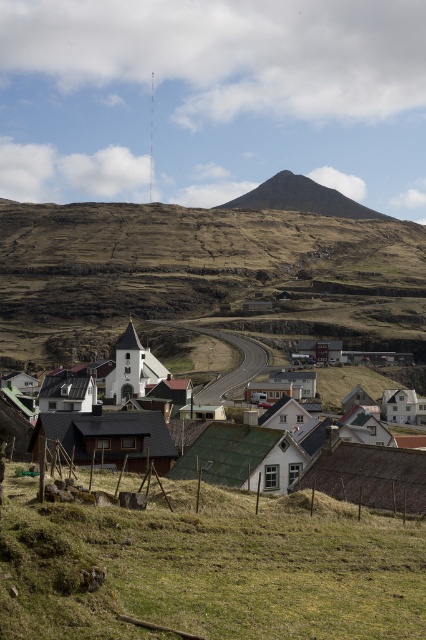
Who is more distant from viewer, (207, 561) or (120, 291)?

The point (120, 291) is behind.

Is green grassy hillside at lower center above brown grassy hillside at center?

Incorrect, green grassy hillside at lower center is not positioned above brown grassy hillside at center.

Is point (52, 621) in front of point (143, 296)?

Yes, it is in front of point (143, 296).

This screenshot has height=640, width=426. Identify the location of green grassy hillside at lower center. (209, 566).

Is the position of green grassy hillside at lower center less distant than that of green corrugated metal roofs at center?

Yes, green grassy hillside at lower center is closer to the viewer.

This screenshot has width=426, height=640. Identify the location of green grassy hillside at lower center. (209, 566).

The width and height of the screenshot is (426, 640). Describe the element at coordinates (209, 566) in the screenshot. I see `green grassy hillside at lower center` at that location.

At what (x,y) coordinates should I click in order to perform the action: click on green grassy hillside at lower center. Please return your answer as a coordinate pair (x, y). The height and width of the screenshot is (640, 426). Looking at the image, I should click on (209, 566).

Between point (176, 616) and point (354, 218), which one is positioned in front?

Point (176, 616)

What do you see at coordinates (209, 566) in the screenshot?
I see `green grassy hillside at lower center` at bounding box center [209, 566].

At what (x,y) coordinates should I click in order to perform the action: click on green grassy hillside at lower center. Please return your answer as a coordinate pair (x, y). This screenshot has height=640, width=426. Looking at the image, I should click on (209, 566).